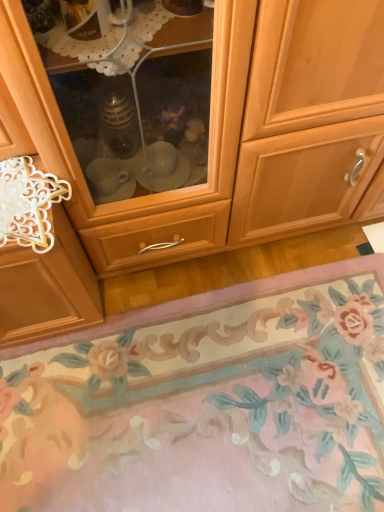
The image size is (384, 512). What do you see at coordinates (207, 403) in the screenshot?
I see `floral carpet at lower center` at bounding box center [207, 403].

Where is `floral carpet at lower center`? This screenshot has width=384, height=512. floral carpet at lower center is located at coordinates (207, 403).

I want to click on floral carpet at lower center, so click(207, 403).